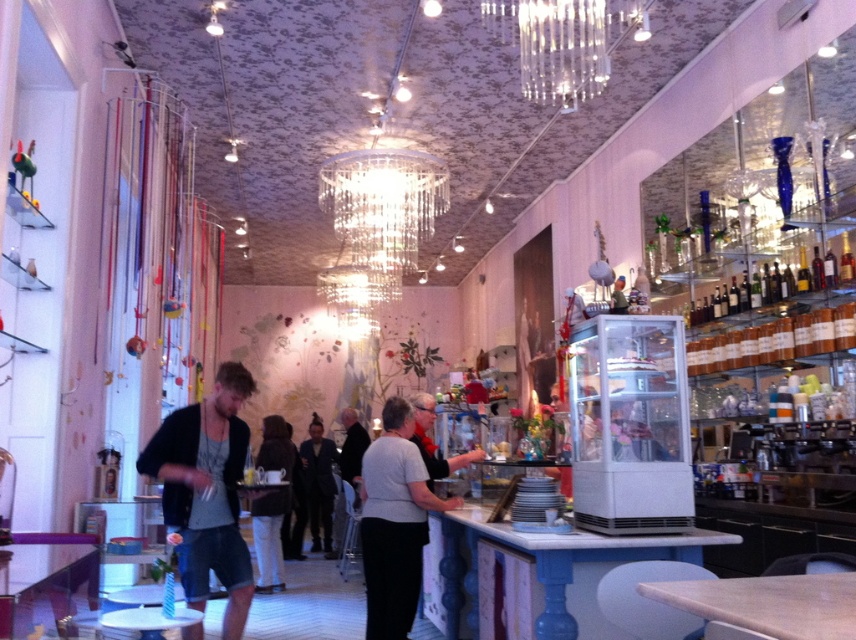
Is point (418, 502) in front of point (310, 477)?

Yes, point (418, 502) is in front of point (310, 477).

Does gray matte shirt at center come behind dark brown leather jacket at center?

No, gray matte shirt at center is closer to the viewer.

Between point (367, 532) and point (316, 426), which one is positioned behind?

The point (316, 426) is behind.

Locate an element on the screen. gray matte shirt at center is located at coordinates (394, 522).

Is point (241, 384) in front of point (360, 456)?

Yes, it is in front of point (360, 456).

Who is more distant from viewer, (242, 456) or (339, 470)?

The point (339, 470) is more distant.

What are the coordinates of `denim shorts at center` in the screenshot? It's located at (206, 492).

Locate an element on the screen. denim shorts at center is located at coordinates (206, 492).

Does clear crystal chandelier at upper center have a smaller size compared to black fabric jacket at center?

No.

Between point (550, 0) and point (355, 412), which one is positioned behind?

The point (355, 412) is more distant.

Locate an element on the screen. This screenshot has width=856, height=640. clear crystal chandelier at upper center is located at coordinates (563, 42).